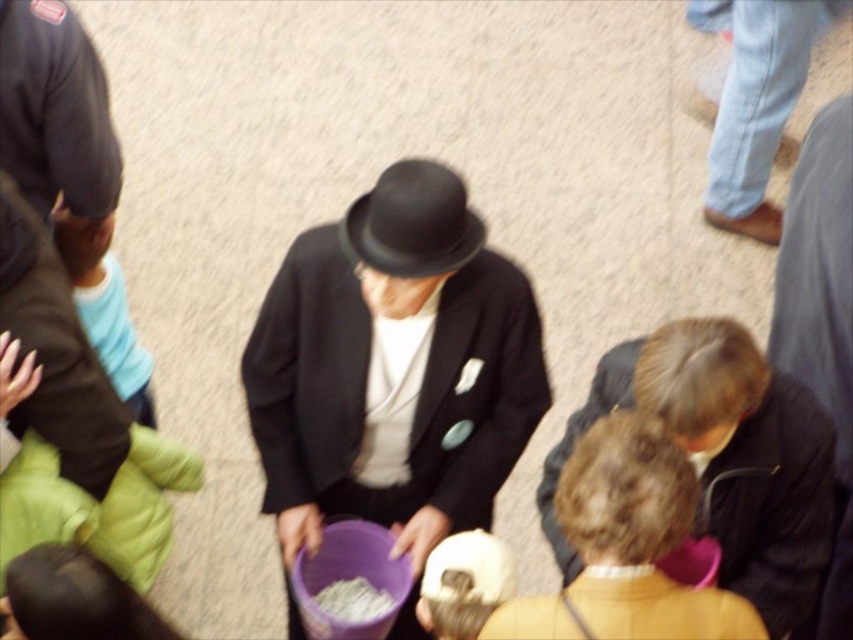
In the scene shown: You are a photographer trying to capture a closeup of the white crumbly food at center without including the matte black hat at center in the frame. Based on their sizes, is this feasible?

The matte black hat at center is wider than the white crumbly food at center, so it might be challenging to frame the food without including the hat if they are both at the same distance from the camera.

Consider the image. You are a drone operator trying to deliver a package to the matte yellow sweater at center. According to the image coordinates, where should you direct the drone to drop the package?

The matte yellow sweater at center is located at point (625, 547), so you should direct the drone to drop the package at those coordinates.